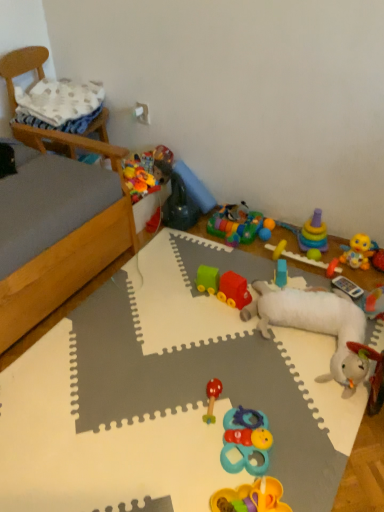
Where is `vacant region to the left of white plush sheep at center, the third toy ordered from the bottom`? Image resolution: width=384 pixels, height=512 pixels. vacant region to the left of white plush sheep at center, the third toy ordered from the bottom is located at coordinates (179, 352).